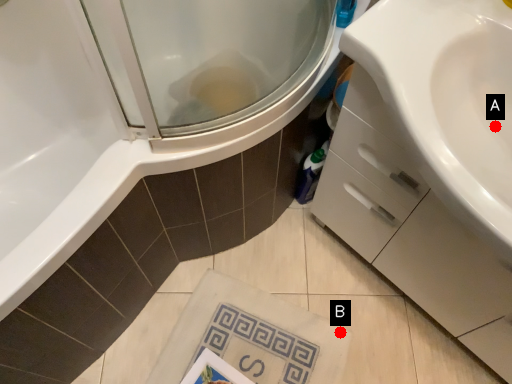
Question: Two points are circled on the image, labeled by A and B beside each circle. Which point is closer to the camera?

Choices:
 (A) A is closer
 (B) B is closer

Answer: (A)